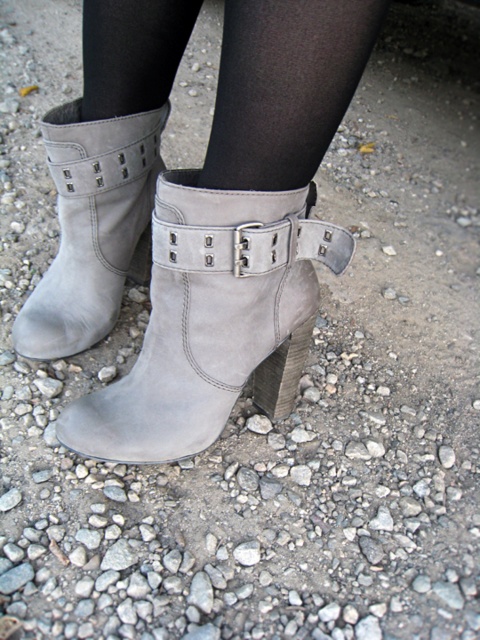
In the scene shown: Is suede boot at center positioned before suede gray boot at lower center?

Yes, it is in front of suede gray boot at lower center.

Does point (176, 42) lie behind point (66, 346)?

No.

The height and width of the screenshot is (640, 480). I want to click on suede boot at center, so click(x=285, y=88).

Between suede gray boot at center and suede boot at center, which one appears on the right side from the viewer's perspective?

Positioned to the right is suede gray boot at center.

In the scene shown: How far apart are suede gray boot at center and suede boot at center?

suede gray boot at center and suede boot at center are 6.96 inches apart.

Between point (152, 365) and point (169, 36), which one is positioned in front?

Point (152, 365) is more forward.

In order to click on suede gray boot at center in this screenshot , I will do `click(207, 316)`.

Does suede gray boot at center have a larger size compared to suede gray boot at lower center?

Actually, suede gray boot at center might be smaller than suede gray boot at lower center.

Can you confirm if suede gray boot at center is positioned above suede gray boot at lower center?

Actually, suede gray boot at center is below suede gray boot at lower center.

In the scene shown: Who is more forward, (232, 224) or (79, 349)?

Positioned in front is point (232, 224).

Find the location of a particular element. This screenshot has width=480, height=640. suede gray boot at center is located at coordinates (207, 316).